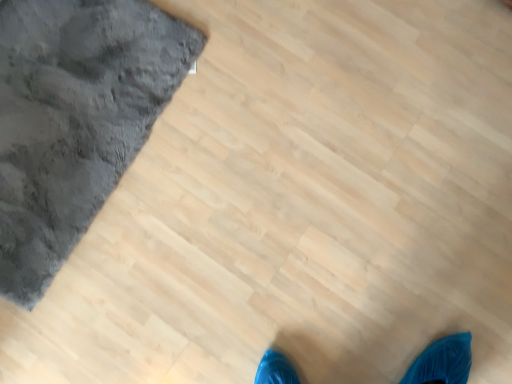
Where is `vacant area that is situated to the right of dark gray plush bath mat at upper left`? The height and width of the screenshot is (384, 512). vacant area that is situated to the right of dark gray plush bath mat at upper left is located at coordinates (279, 158).